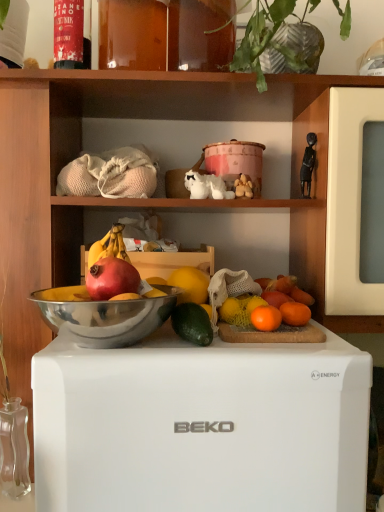
The width and height of the screenshot is (384, 512). In order to click on vacant space to the left of green matte avocado at center in this screenshot , I will do `click(119, 348)`.